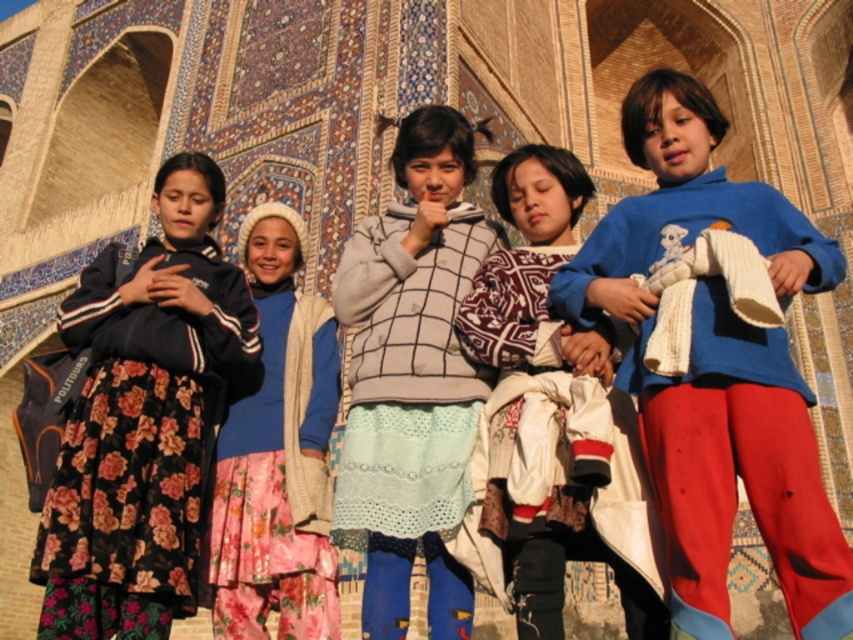
You are a photographer trying to capture the two children wearing blue sweaters in the image. The scene has a beautiful architectural backdrop with intricate designs. You want to ensure both children are framed properly. Since the two blue sweaters are at the center, can you determine which one is on the left side between the blue cotton sweater at center and the blue soft sweater at center?

The blue soft sweater at center is on the left side because the blue cotton sweater at center is positioned to its right.